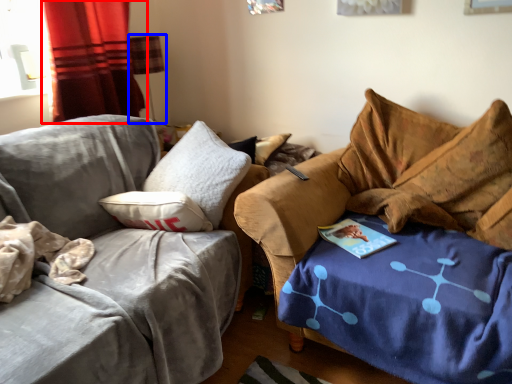
Question: Which of the following is the closest to the observer, curtain (highlighted by a red box) or lamp (highlighted by a blue box)?

Choices:
 (A) curtain
 (B) lamp

Answer: (A)